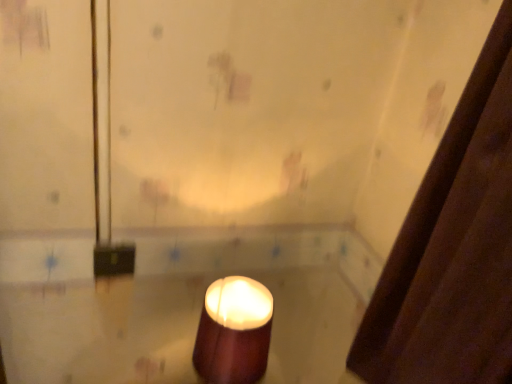
Describe the element at coordinates (234, 332) in the screenshot. I see `matte brown candle at center` at that location.

Find the location of a particular element. matte brown candle at center is located at coordinates (234, 332).

Measure the distance between brown fabric shower curtain at right and camera.

They are 48.48 centimeters apart.

Identify the location of brown fabric shower curtain at right. The width and height of the screenshot is (512, 384). (453, 248).

What do you see at coordinates (453, 248) in the screenshot? Image resolution: width=512 pixels, height=384 pixels. I see `brown fabric shower curtain at right` at bounding box center [453, 248].

Where is `matte brown candle at center`? matte brown candle at center is located at coordinates (234, 332).

Considering the positions of objects brown fabric shower curtain at right and matte brown candle at center in the image provided, who is more to the right, brown fabric shower curtain at right or matte brown candle at center?

brown fabric shower curtain at right.

Which object is more forward, brown fabric shower curtain at right or matte brown candle at center?

brown fabric shower curtain at right is closer to the camera.

Consider the image. Which is closer to the camera, (x=499, y=320) or (x=268, y=296)?

Point (x=499, y=320) is closer to the camera than point (x=268, y=296).

From the image's perspective, is brown fabric shower curtain at right positioned above or below matte brown candle at center?

Clearly, from the image's perspective, brown fabric shower curtain at right is above matte brown candle at center.

From a real-world perspective, is brown fabric shower curtain at right under matte brown candle at center?

Incorrect, from a real-world perspective, brown fabric shower curtain at right is higher than matte brown candle at center.

Is brown fabric shower curtain at right thinner than matte brown candle at center?

Yes, brown fabric shower curtain at right is thinner than matte brown candle at center.

Does brown fabric shower curtain at right have a lesser height compared to matte brown candle at center?

In fact, brown fabric shower curtain at right may be taller than matte brown candle at center.

Is brown fabric shower curtain at right smaller than matte brown candle at center?

No, brown fabric shower curtain at right is not smaller than matte brown candle at center.

Do you think brown fabric shower curtain at right is within matte brown candle at center, or outside of it?

brown fabric shower curtain at right is not inside matte brown candle at center, it's outside.

Can you see brown fabric shower curtain at right touching matte brown candle at center?

They are not placed beside each other.

Is brown fabric shower curtain at right oriented away from matte brown candle at center?

No, brown fabric shower curtain at right's orientation is not away from matte brown candle at center.

This screenshot has width=512, height=384. In the image, there is a brown fabric shower curtain at right. What are the coordinates of `candle below it (from a real-world perspective)` in the screenshot? It's located at (234, 332).

Considering the relative positions of matte brown candle at center and brown fabric shower curtain at right in the image provided, is matte brown candle at center to the left or to the right of brown fabric shower curtain at right?

matte brown candle at center is to the left of brown fabric shower curtain at right.

Which object is further away from the camera taking this photo, matte brown candle at center or brown fabric shower curtain at right?

matte brown candle at center is behind.

Is point (236, 316) in front of point (501, 200)?

No.

From the image's perspective, which is above, matte brown candle at center or brown fabric shower curtain at right?

brown fabric shower curtain at right appears higher in the image.

From a real-world perspective, is matte brown candle at center located beneath brown fabric shower curtain at right?

Indeed, from a real-world perspective, matte brown candle at center is positioned beneath brown fabric shower curtain at right.

Is matte brown candle at center wider or thinner than brown fabric shower curtain at right?

Clearly, matte brown candle at center has more width compared to brown fabric shower curtain at right.

Between matte brown candle at center and brown fabric shower curtain at right, which one has more height?

With more height is brown fabric shower curtain at right.

Based on their sizes in the image, would you say matte brown candle at center is bigger or smaller than brown fabric shower curtain at right?

matte brown candle at center is smaller than brown fabric shower curtain at right.

Is brown fabric shower curtain at right a part of matte brown candle at center?

No, brown fabric shower curtain at right is located outside of matte brown candle at center.

Are matte brown candle at center and brown fabric shower curtain at right making contact?

No, matte brown candle at center is not in contact with brown fabric shower curtain at right.

Is matte brown candle at center facing away from brown fabric shower curtain at right?

That's not correct — matte brown candle at center is not looking away from brown fabric shower curtain at right.

I want to click on candle that appears on the left of brown fabric shower curtain at right, so click(x=234, y=332).

Locate an element on the screen. This screenshot has height=384, width=512. shower curtain above the matte brown candle at center (from a real-world perspective) is located at coordinates (453, 248).

Where is `candle directly beneath the brown fabric shower curtain at right (from a real-world perspective)`? The image size is (512, 384). candle directly beneath the brown fabric shower curtain at right (from a real-world perspective) is located at coordinates (234, 332).